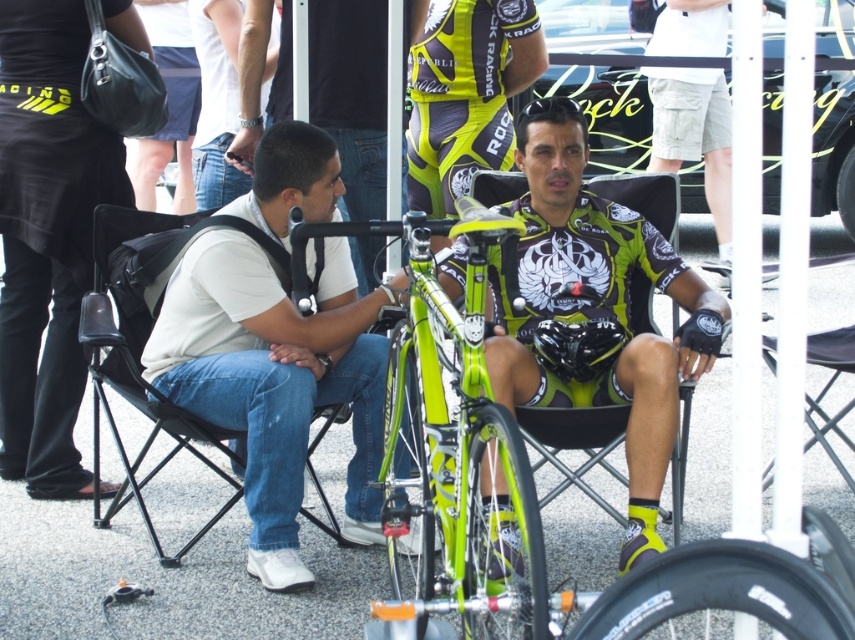
Question: Which point is closer to the camera?

Choices:
 (A) (236, 486)
 (B) (416, 417)
 (C) (543, 636)

Answer: (C)

Question: Estimate the real-world distances between objects in this image. Which object is closer to the white cotton shirt at left?

Choices:
 (A) green rubber tire at center
 (B) green glossy bicycle at center

Answer: (B)

Question: Does black fabric chair at left appear over green rubber tire at center?

Choices:
 (A) no
 (B) yes

Answer: (B)

Question: Estimate the real-world distances between objects in this image. Which object is closer to the black fabric chair at left?

Choices:
 (A) white cotton shirt at left
 (B) green matte bicycle tire at center
 (C) black rubber tire at center

Answer: (A)

Question: Does black rubber tire at center appear on the left side of green rubber tire at center?

Choices:
 (A) no
 (B) yes

Answer: (A)

Question: Is green matte cycling jersey at center wider than black rubber tire at center?

Choices:
 (A) no
 (B) yes

Answer: (B)